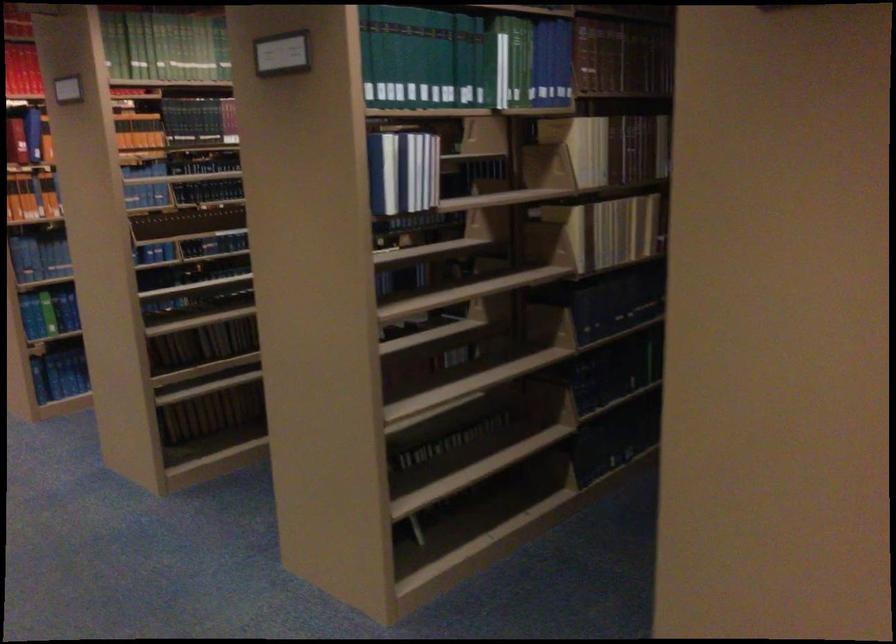
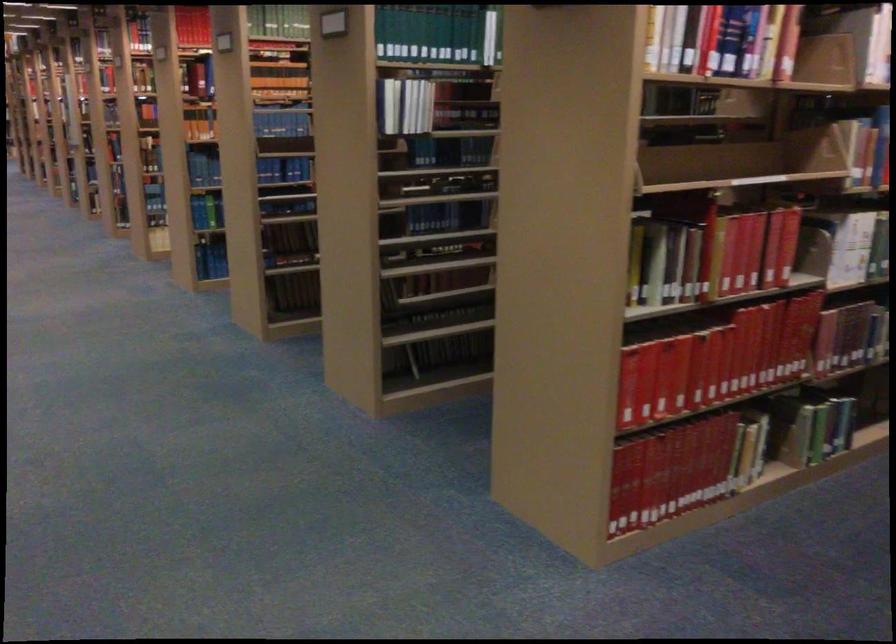
Find the pixel in the second image that matches pixel 138 180 in the first image.

(280, 122)